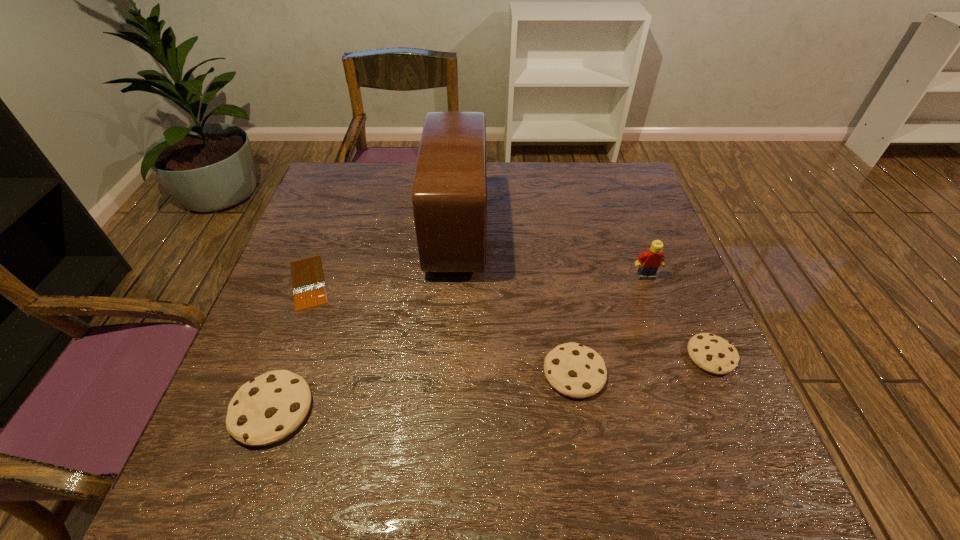
Identify the location of free spot that satisfies the following two spatial constraints: 1. on the back side of the third shortest object; 2. on the front-facing side of the radio receiver. (550, 230).

Where is `vacant space that satisfies the following two spatial constraints: 1. on the front-facing side of the rightmost cookie; 2. on the left side of the Lego`? Image resolution: width=960 pixels, height=540 pixels. vacant space that satisfies the following two spatial constraints: 1. on the front-facing side of the rightmost cookie; 2. on the left side of the Lego is located at coordinates (675, 356).

Identify the location of free location that satisfies the following two spatial constraints: 1. on the back side of the third shortest object; 2. on the front-facing side of the tallest object. (550, 230).

Identify the location of vacant space that satisfies the following two spatial constraints: 1. on the front-facing side of the tallest object; 2. on the left side of the third object from right to left. (449, 373).